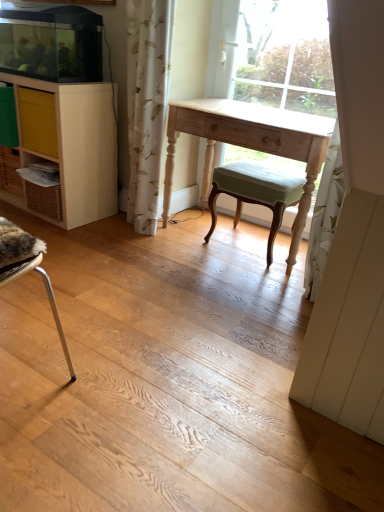
Question: Does light wood desk at center come behind yellow matte drawer at left?

Choices:
 (A) yes
 (B) no

Answer: (B)

Question: Is light wood desk at center thinner than yellow matte drawer at left?

Choices:
 (A) yes
 (B) no

Answer: (B)

Question: Can you confirm if light wood desk at center is shorter than yellow matte drawer at left?

Choices:
 (A) yes
 (B) no

Answer: (B)

Question: Is the position of light wood desk at center less distant than that of yellow matte drawer at left?

Choices:
 (A) no
 (B) yes

Answer: (B)

Question: Is light wood desk at center positioned with its back to yellow matte drawer at left?

Choices:
 (A) yes
 (B) no

Answer: (B)

Question: Is light wood desk at center not close to yellow matte drawer at left?

Choices:
 (A) yes
 (B) no

Answer: (B)

Question: Is white floral fabric curtain at center completely or partially inside light wood desk at center?

Choices:
 (A) no
 (B) yes

Answer: (A)

Question: Does light wood desk at center touch white floral fabric curtain at center?

Choices:
 (A) yes
 (B) no

Answer: (B)

Question: Is light wood desk at center not within white floral fabric curtain at center?

Choices:
 (A) yes
 (B) no

Answer: (A)

Question: Considering the relative positions of light wood desk at center and white floral fabric curtain at center in the image provided, is light wood desk at center in front of white floral fabric curtain at center?

Choices:
 (A) no
 (B) yes

Answer: (A)

Question: Is light wood desk at center aimed at white floral fabric curtain at center?

Choices:
 (A) yes
 (B) no

Answer: (A)

Question: Is white floral fabric curtain at center at the back of light wood desk at center?

Choices:
 (A) yes
 (B) no

Answer: (B)

Question: Are light wood desk at center and light green fabric stool at center far apart?

Choices:
 (A) yes
 (B) no

Answer: (B)